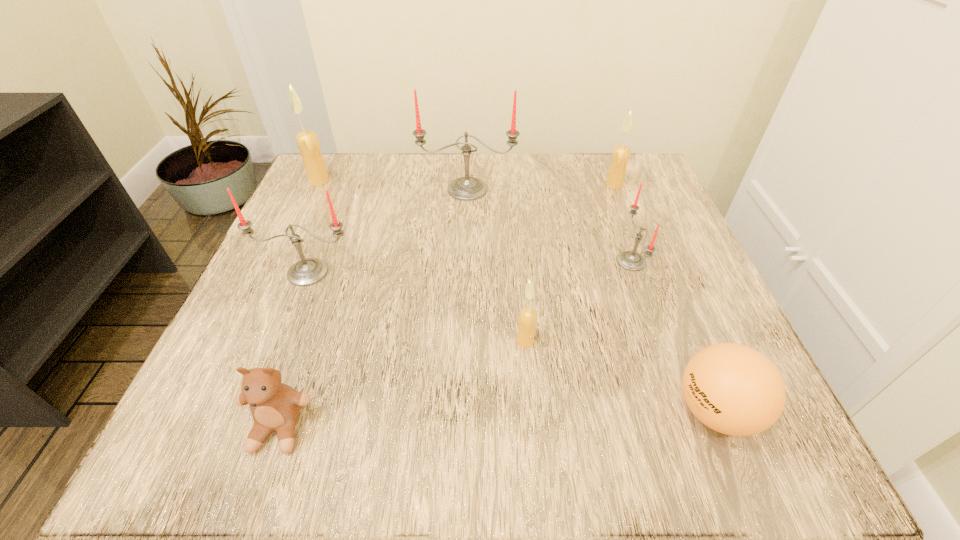
Where is `vacant space that's between the teddy bear and the rightmost red candle`? This screenshot has height=540, width=960. vacant space that's between the teddy bear and the rightmost red candle is located at coordinates (455, 345).

At what (x,y) coordinates should I click in order to perform the action: click on free point between the sixth farthest object and the smallest red candle. Please return your answer as a coordinate pair (x, y). Looking at the image, I should click on (578, 301).

Image resolution: width=960 pixels, height=540 pixels. In order to click on empty space between the ping-pong ball and the biggest cream candle in this screenshot , I will do `click(517, 296)`.

Locate an element on the screen. This screenshot has height=540, width=960. vacant point located between the leftmost cream candle and the teddy bear is located at coordinates (300, 304).

Locate an element on the screen. The image size is (960, 540). empty space that is in between the rightmost cream candle and the nearest cream candle is located at coordinates (569, 263).

The width and height of the screenshot is (960, 540). In order to click on empty space that is in between the teddy bear and the third nearest object in this screenshot , I will do `click(402, 384)`.

Locate an element on the screen. The width and height of the screenshot is (960, 540). object that ranks as the fifth closest to the brown teddy bear is located at coordinates (630, 260).

Locate which object ranks fourth in proximity to the biggest cream candle. Please provide its 2D coordinates. Your answer should be formatted as a tuple, i.e. [(x, y)], where the tuple contains the x and y coordinates of a point satisfying the conditions above.

[(527, 320)]

Locate an element on the screen. Image resolution: width=960 pixels, height=540 pixels. candle object that ranks as the fifth closest to the biggest red candle is located at coordinates (527, 320).

Locate an element on the screen. Image resolution: width=960 pixels, height=540 pixels. candle identified as the fifth closest to the biggest cream candle is located at coordinates (621, 153).